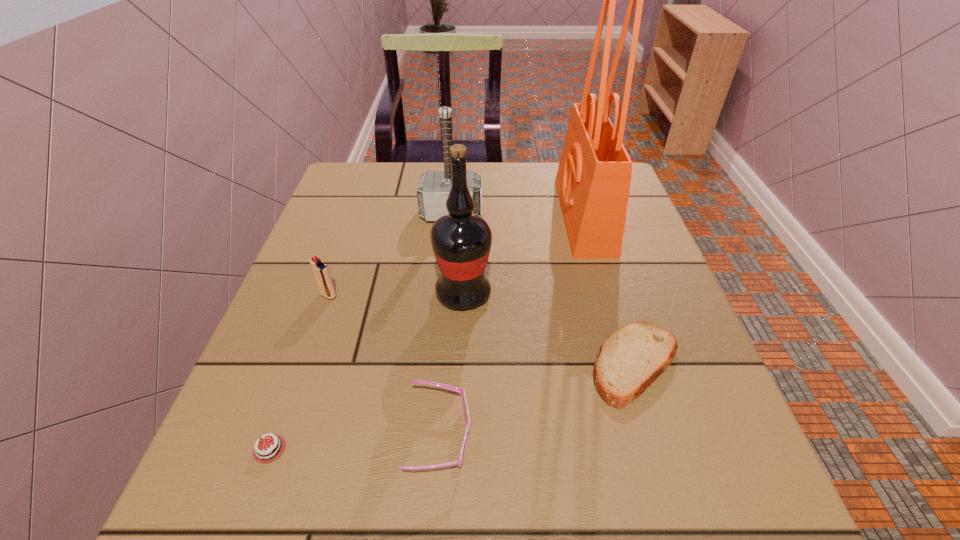
This screenshot has width=960, height=540. In order to click on igniter at the left edge in this screenshot , I will do `click(321, 272)`.

At what (x,y) coordinates should I click in order to perform the action: click on chocolate cake located in the left edge section of the desktop. Please return your answer as a coordinate pair (x, y). The width and height of the screenshot is (960, 540). Looking at the image, I should click on (269, 450).

You are a GUI agent. You are given a task and a screenshot of the screen. Output one action in this format:
    pyautogui.click(x=<x>, y=<y>)
    Task: Click on the tote bag that is at the right edge
    Image resolution: width=960 pixels, height=540 pixels.
    Given the screenshot: What is the action you would take?
    pyautogui.click(x=593, y=180)

Locate an element on the screen. Image resolution: width=960 pixels, height=540 pixels. pita bread that is at the right edge is located at coordinates coord(631,358).

Where is `object that is at the near left corner`? This screenshot has width=960, height=540. object that is at the near left corner is located at coordinates (269, 450).

Where is `object positioned at the far right corner`? object positioned at the far right corner is located at coordinates 593,180.

Locate an element on the screen. vacant space at the far edge of the desktop is located at coordinates (541, 187).

The height and width of the screenshot is (540, 960). I want to click on vacant space at the near edge, so click(320, 503).

I want to click on free location at the left edge of the desktop, so (335, 416).

Where is `vacant space at the right edge of the desktop`? vacant space at the right edge of the desktop is located at coordinates (684, 327).